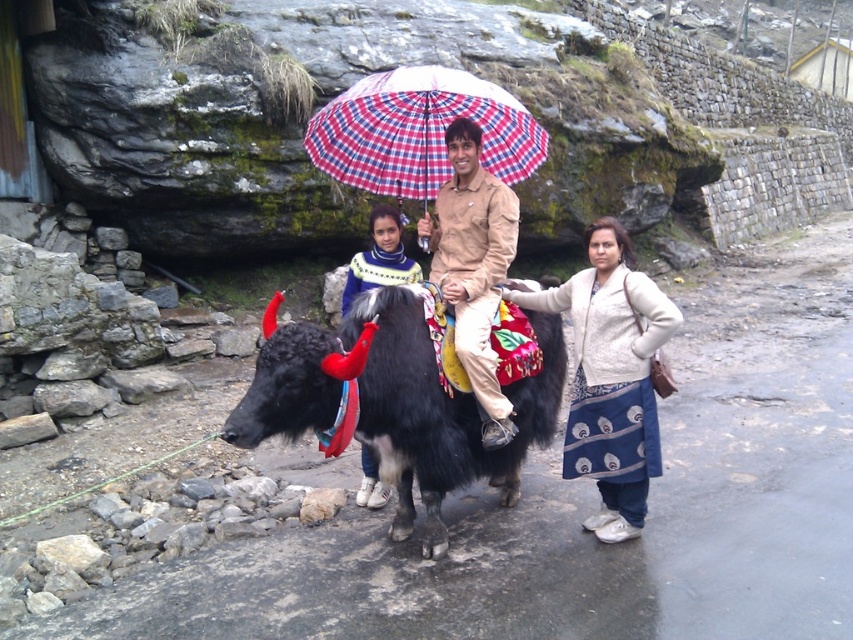
Question: Which point is farther to the camera?

Choices:
 (A) black fuzzy yak at center
 (B) beige cotton shirt at center
 (C) knitted sweater at center
 (D) blue printed dress at right

Answer: (C)

Question: Considering the real-world distances, which object is closest to the black fuzzy yak at center?

Choices:
 (A) blue printed dress at right
 (B) beige cotton shirt at center
 (C) plaid fabric umbrella at center
 (D) knitted sweater at center

Answer: (B)

Question: Can you confirm if black fuzzy yak at center is positioned to the left of knitted sweater at center?

Choices:
 (A) yes
 (B) no

Answer: (B)

Question: Can you confirm if blue printed dress at right is positioned to the left of beige cotton shirt at center?

Choices:
 (A) no
 (B) yes

Answer: (A)

Question: Among these objects, which one is nearest to the camera?

Choices:
 (A) plaid fabric umbrella at center
 (B) beige cotton shirt at center
 (C) black fuzzy yak at center
 (D) knitted sweater at center

Answer: (C)

Question: Does plaid fabric umbrella at center appear over beige cotton shirt at center?

Choices:
 (A) yes
 (B) no

Answer: (A)